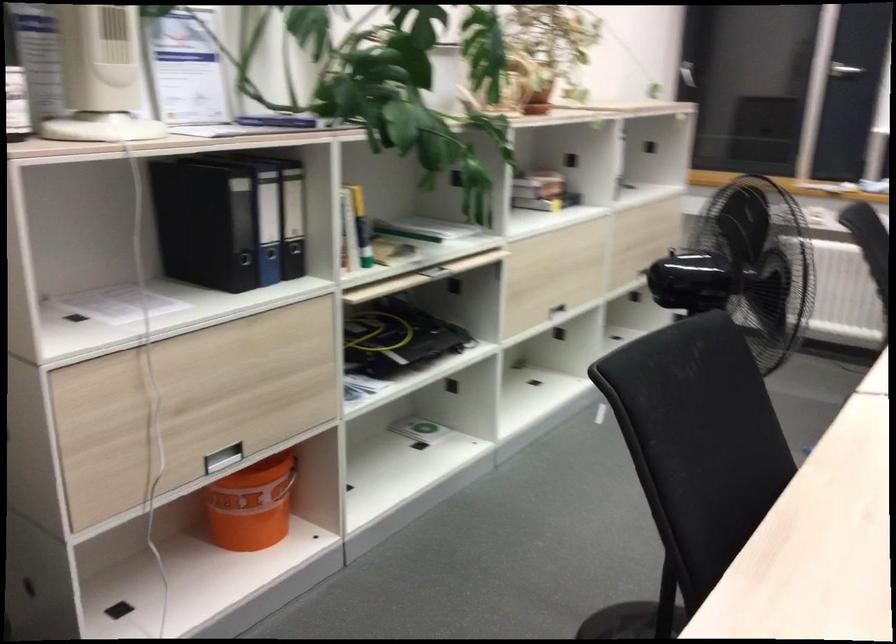
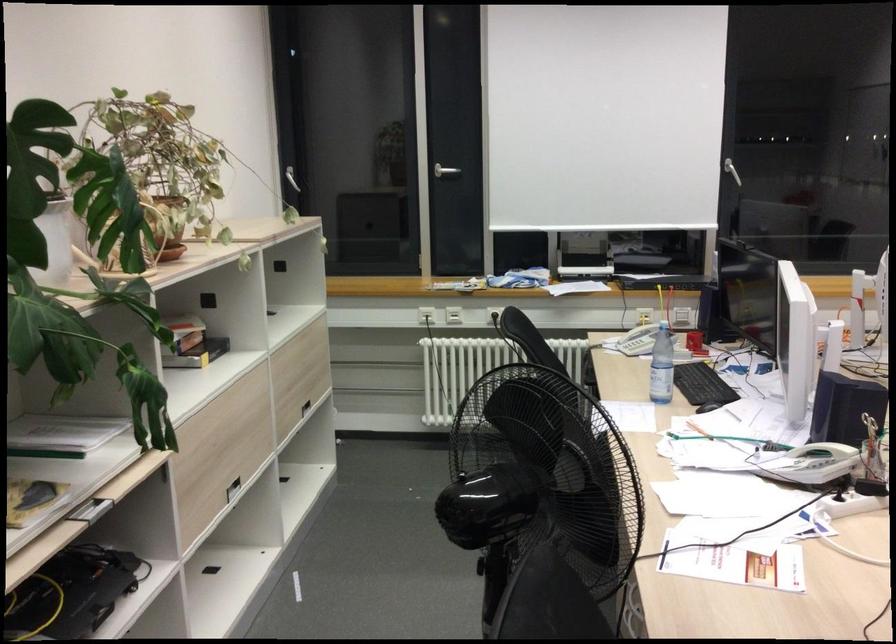
Find the pixel in the second image that matches pixel 550 263 in the first image.

(225, 435)